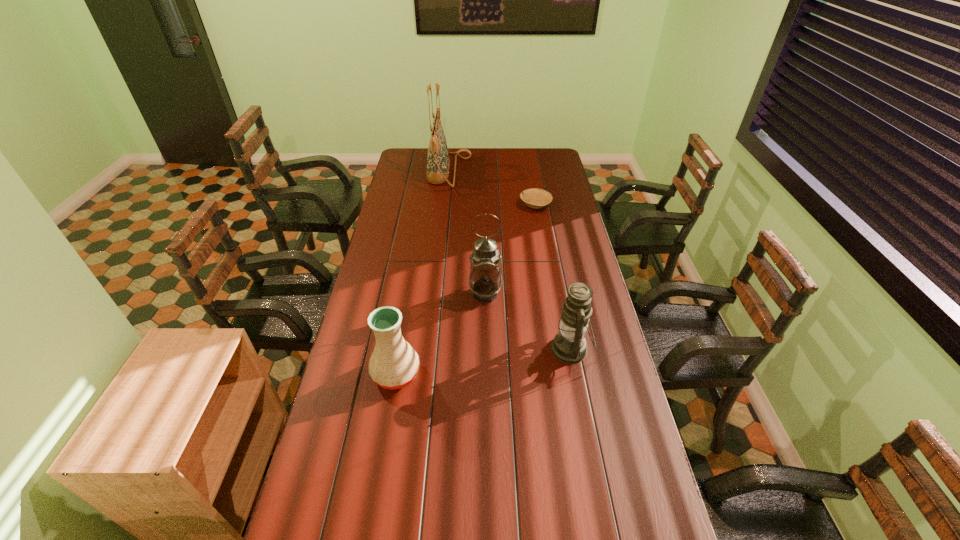
You are a GUI agent. You are given a task and a screenshot of the screen. Output one action in this format:
    pyautogui.click(x=<x>, y=<y>)
    Task: Click on the free space at the far right corner
    
    Given the screenshot: What is the action you would take?
    pyautogui.click(x=547, y=148)

You are a GUI agent. You are given a task and a screenshot of the screen. Output one action in this format:
    pyautogui.click(x=<x>, y=<y>)
    Task: Click on the vacant point located between the handbag and the pottery
    
    Given the screenshot: What is the action you would take?
    pyautogui.click(x=422, y=273)

I want to click on empty space between the pottery and the shortest object, so click(x=466, y=289).

You are a GUI agent. You are given a task and a screenshot of the screen. Output one action in this format:
    pyautogui.click(x=<x>, y=<y>)
    Task: Click on the vacant area that lies between the pottery and the second farthest object
    The image size is (960, 540).
    Given the screenshot: What is the action you would take?
    pyautogui.click(x=466, y=289)

Where is `vacant region between the bowl and the handbag`? This screenshot has width=960, height=540. vacant region between the bowl and the handbag is located at coordinates (492, 188).

The width and height of the screenshot is (960, 540). I want to click on free spot between the third object from left to right and the farthest object, so click(468, 232).

At what (x,y) coordinates should I click in order to perform the action: click on vacant region between the taller oil lamp and the pottery. Please return your answer as a coordinate pair (x, y). This screenshot has width=960, height=540. Looking at the image, I should click on (441, 334).

Where is `vacant area between the tallest object and the pottery`? vacant area between the tallest object and the pottery is located at coordinates (422, 273).

The width and height of the screenshot is (960, 540). I want to click on unoccupied area between the farther oil lamp and the farthest object, so click(468, 232).

Identify the location of empty space that is in between the shortest object and the pottery. This screenshot has width=960, height=540. (466, 289).